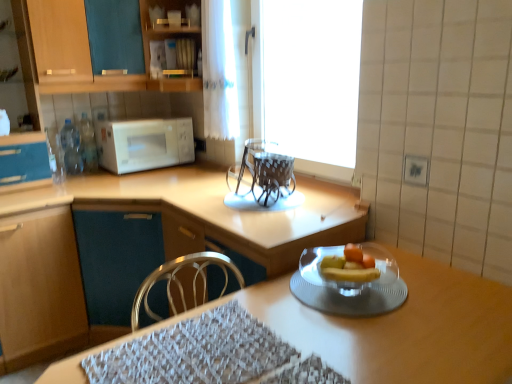
Question: Can you confirm if white glossy microwave at upper left is wider than transparent plastic chairs at center?

Choices:
 (A) no
 (B) yes

Answer: (B)

Question: Considering the relative sizes of white glossy microwave at upper left and transparent plastic chairs at center in the image provided, is white glossy microwave at upper left shorter than transparent plastic chairs at center?

Choices:
 (A) no
 (B) yes

Answer: (A)

Question: From a real-world perspective, is white glossy microwave at upper left beneath transparent plastic chairs at center?

Choices:
 (A) no
 (B) yes

Answer: (A)

Question: Is white glossy microwave at upper left in front of transparent plastic chairs at center?

Choices:
 (A) yes
 (B) no

Answer: (B)

Question: Is white glossy microwave at upper left to the left of transparent plastic chairs at center from the viewer's perspective?

Choices:
 (A) no
 (B) yes

Answer: (B)

Question: From the image's perspective, is matte wood cabinet at left, which appears as the second cabinetry when ordered from the bottom, above or below wooden table at center?

Choices:
 (A) above
 (B) below

Answer: (A)

Question: Is matte wood cabinet at left, which appears as the second cabinetry when ordered from the bottom, bigger or smaller than wooden table at center?

Choices:
 (A) small
 (B) big

Answer: (A)

Question: Considering the positions of matte wood cabinet at left, which ranks as the second cabinetry in top-to-bottom order, and wooden table at center in the image, is matte wood cabinet at left, which ranks as the second cabinetry in top-to-bottom order, wider or thinner than wooden table at center?

Choices:
 (A) thin
 (B) wide

Answer: (B)

Question: Would you say matte wood cabinet at left, which ranks as the second cabinetry in top-to-bottom order, is to the left or to the right of wooden table at center in the picture?

Choices:
 (A) right
 (B) left

Answer: (B)

Question: From the image's perspective, relative to matte wood cabinet at lower left, which is the 1th cabinetry from bottom to top, is white glossy microwave at upper left above or below?

Choices:
 (A) below
 (B) above

Answer: (B)

Question: Is white glossy microwave at upper left taller or shorter than matte wood cabinet at lower left, which is the third cabinetry from top to bottom?

Choices:
 (A) tall
 (B) short

Answer: (B)

Question: In terms of size, does white glossy microwave at upper left appear bigger or smaller than matte wood cabinet at lower left, which is the third cabinetry from top to bottom?

Choices:
 (A) small
 (B) big

Answer: (A)

Question: Is white glossy microwave at upper left to the left or to the right of matte wood cabinet at lower left, which is the third cabinetry from top to bottom, in the image?

Choices:
 (A) left
 (B) right

Answer: (B)

Question: Would you say transparent plastic chairs at center is to the left or to the right of matte wood cabinet at lower left, which is the third cabinetry from top to bottom, in the picture?

Choices:
 (A) right
 (B) left

Answer: (A)

Question: From the image's perspective, is transparent plastic chairs at center above or below matte wood cabinet at lower left, which is the third cabinetry from top to bottom?

Choices:
 (A) below
 (B) above

Answer: (B)